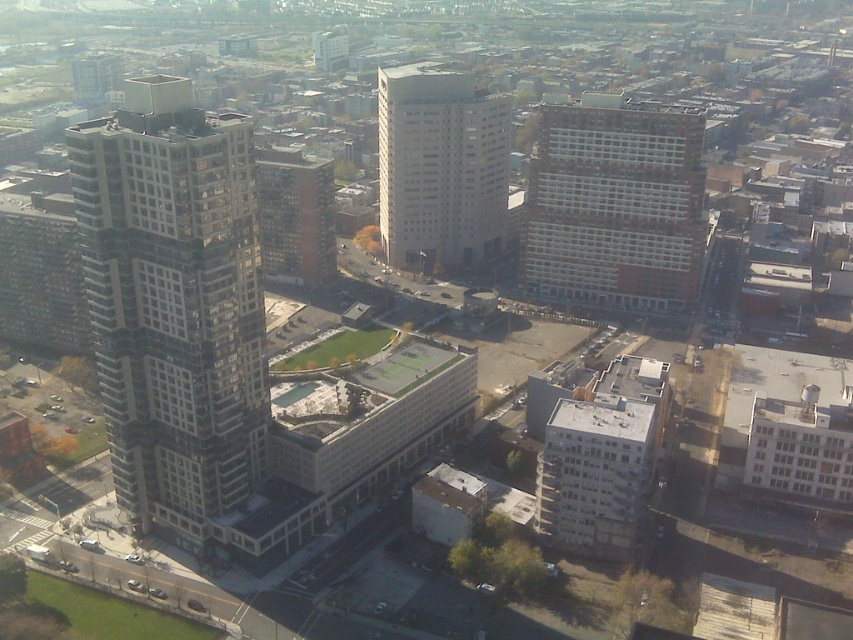
You are a drone operator trying to capture a photo of the white brick building at center and the white glass building at center from above. Based on their positions, which one would appear closer to the camera in the photo?

The white brick building at center appears closer to the camera in the photo because it is positioned in front of the white glass building at center.

You are a drone operator trying to locate the white brick building at center. According to the coordinates provided, where should you direct your drone to find it?

The white brick building at center is located at coordinates point (614, 205).